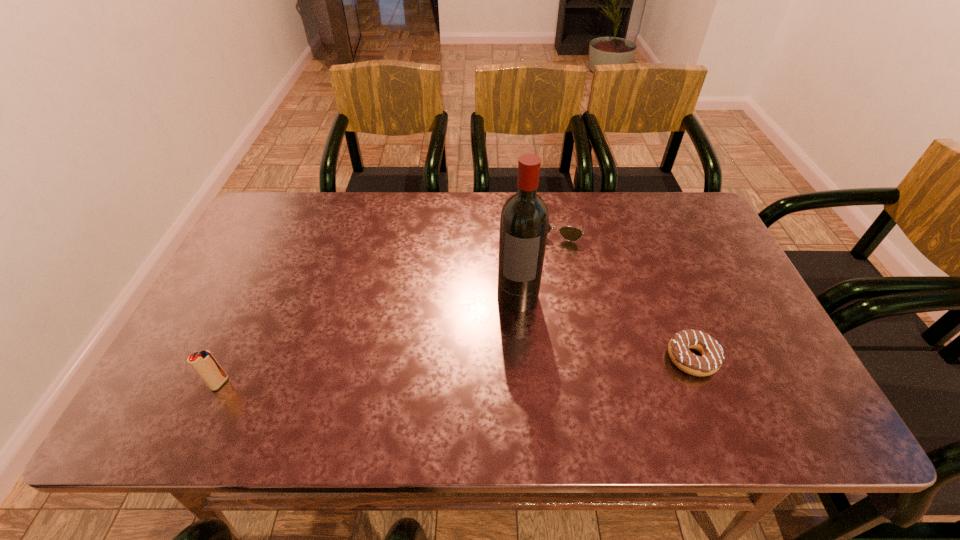
Identify the location of free space that is in between the tallest object and the leftmost object. The width and height of the screenshot is (960, 540). (369, 340).

This screenshot has width=960, height=540. I want to click on free spot between the igniter and the doughnut, so click(x=456, y=370).

Find the location of a particular element. The width and height of the screenshot is (960, 540). free space between the rightmost object and the sunglasses is located at coordinates (625, 291).

Identify the location of free space between the shortest object and the second farthest object. (605, 327).

Locate an element on the screen. free point between the shortest object and the third nearest object is located at coordinates (605, 327).

Locate an element on the screen. free space that is in between the wine bottle and the shortest object is located at coordinates (605, 327).

Find the location of a particular element. The width and height of the screenshot is (960, 540). empty space between the shortest object and the tallest object is located at coordinates (605, 327).

Image resolution: width=960 pixels, height=540 pixels. I want to click on vacant area between the shortest object and the tallest object, so click(605, 327).

Select which object is the third closest to the rightmost object. Please provide its 2D coordinates. Your answer should be formatted as a tuple, i.e. [(x, y)], where the tuple contains the x and y coordinates of a point satisfying the conditions above.

[(205, 365)]

Identify which object is the closest to the third shortest object. Please provide its 2D coordinates. Your answer should be formatted as a tuple, i.e. [(x, y)], where the tuple contains the x and y coordinates of a point satisfying the conditions above.

[(524, 221)]